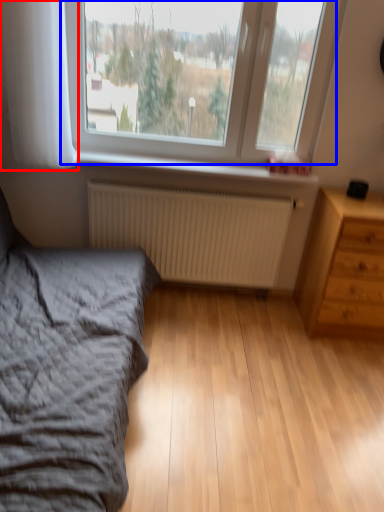
Question: Which object appears closest to the camera in this image, curtain (highlighted by a red box) or window (highlighted by a blue box)?

Choices:
 (A) curtain
 (B) window

Answer: (A)